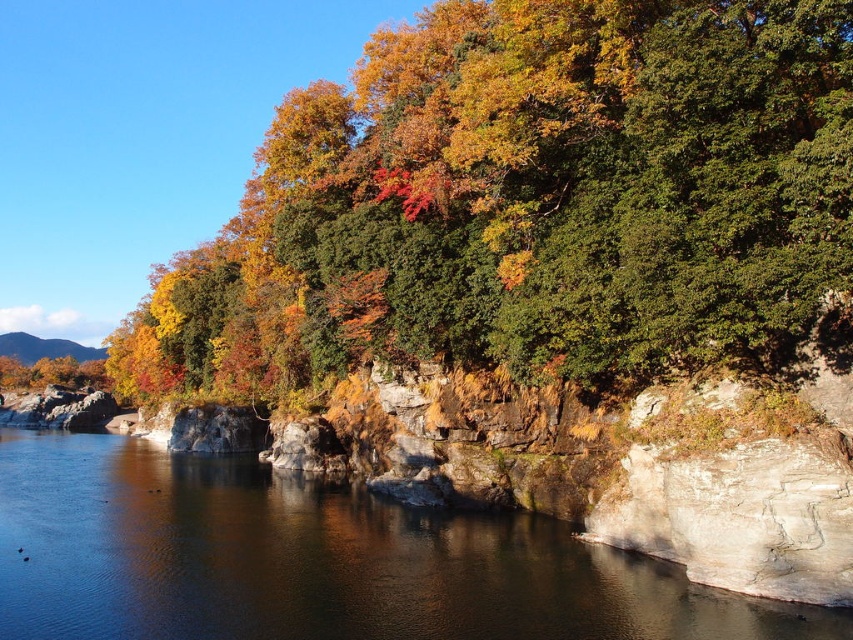
Question: Does autumn leaves at upper center appear on the right side of smooth rock river at center?

Choices:
 (A) yes
 (B) no

Answer: (B)

Question: Can you confirm if autumn leaves at upper center is positioned to the right of smooth rock river at center?

Choices:
 (A) no
 (B) yes

Answer: (A)

Question: Does autumn leaves at upper center appear over smooth rock river at center?

Choices:
 (A) yes
 (B) no

Answer: (A)

Question: Which of the following is the farthest from the observer?

Choices:
 (A) autumn leaves at upper center
 (B) smooth rock river at center

Answer: (A)